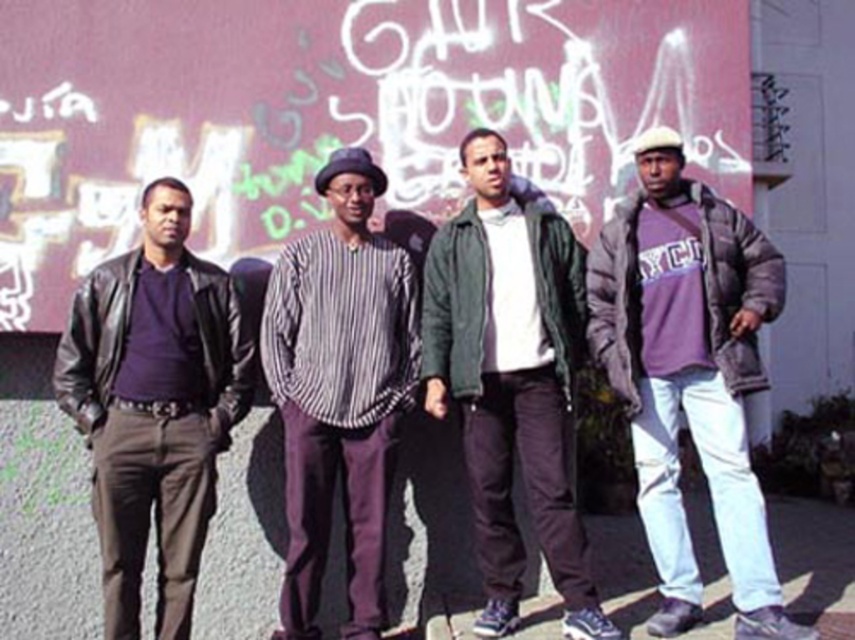
You are standing in front of the graffiti wall and want to take a photo that includes both the point at coordinates point (614, 384) and point (313, 324). Since one of them is closer to you, which point should you focus on to ensure both are in sharp focus?

You should focus on point (313, 324) because it is farther from the camera than point (614, 384). By focusing on the farther point, the closer point will still be within the depth of field, ensuring both are in focus.

You are standing in front of the graffiti wall and notice two people wearing purple clothing. One has a purple fleece jacket at right and the other is wearing purple pants. Which of these two is positioned more to the right?

The purple fleece jacket at right is located at point [688,376], which places it further to the right compared to the individual with purple pants, so the person with the purple fleece jacket at right is more to the right.

You are a photographer trying to capture a group photo of the purple fleece jacket at right and the matte black jacket at left. Based on their heights, which person should stand in the front row to ensure both are visible?

The matte black jacket at left should stand in the front row because it is shorter than the purple fleece jacket at right, allowing the taller individual to be seen behind.